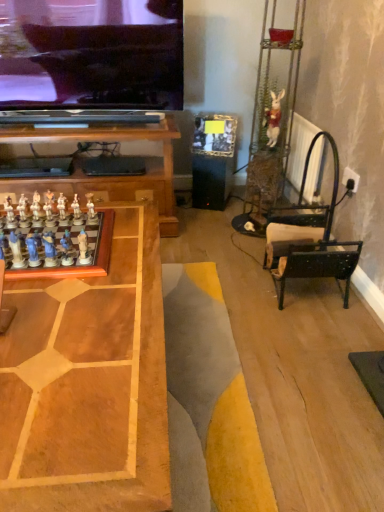
What are the coordinates of `free space in front of white glossy chess set at lower left` in the screenshot? It's located at [62, 317].